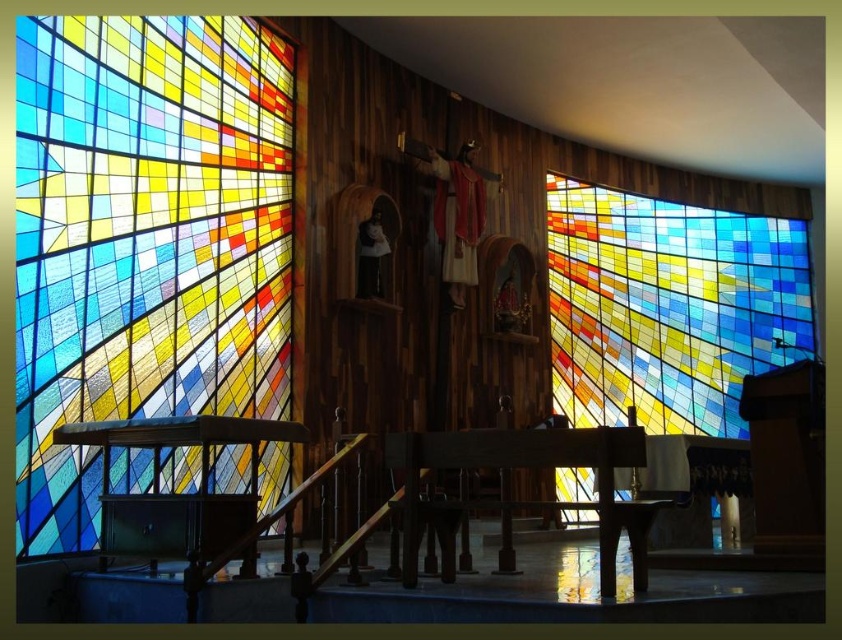
Question: Which of the following is the closest to the observer?

Choices:
 (A) (237, 44)
 (B) (736, 268)

Answer: (A)

Question: Is stained glass window at left positioned before stained glass window at right?

Choices:
 (A) no
 (B) yes

Answer: (B)

Question: Is stained glass window at left bigger than stained glass window at right?

Choices:
 (A) no
 (B) yes

Answer: (A)

Question: Among these objects, which one is farthest from the camera?

Choices:
 (A) stained glass window at right
 (B) stained glass window at left

Answer: (A)

Question: Is stained glass window at left to the right of stained glass window at right from the viewer's perspective?

Choices:
 (A) no
 (B) yes

Answer: (A)